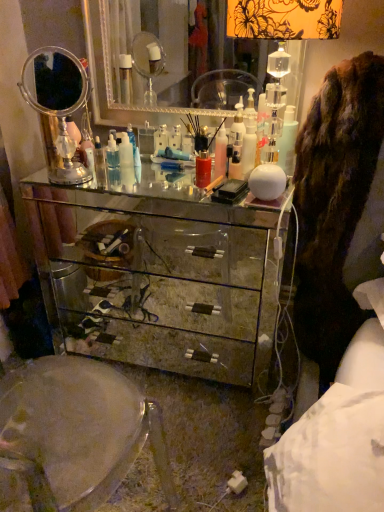
Locate an element on the screen. free location to the right of clear plastic bottle at center, the 1th toiletry from the back is located at coordinates (159, 172).